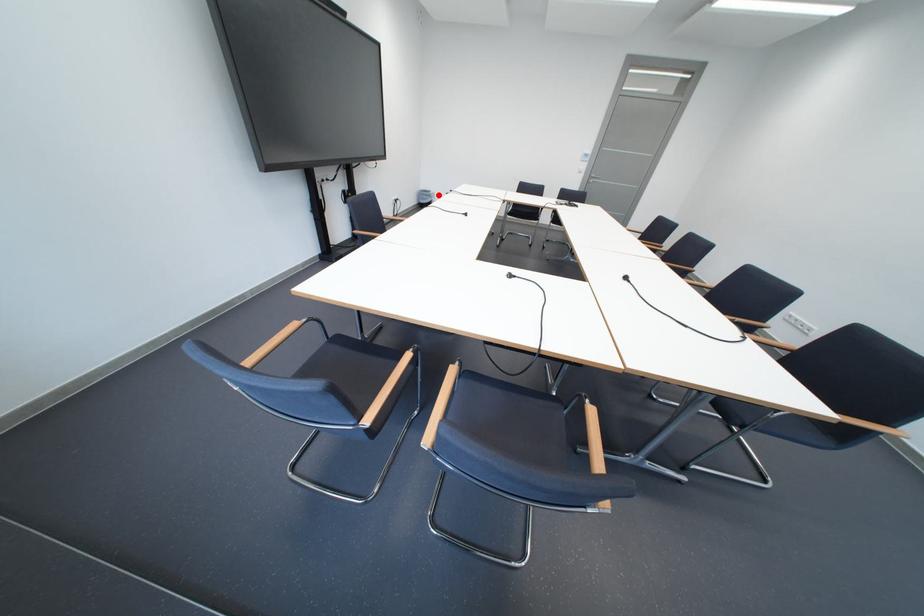
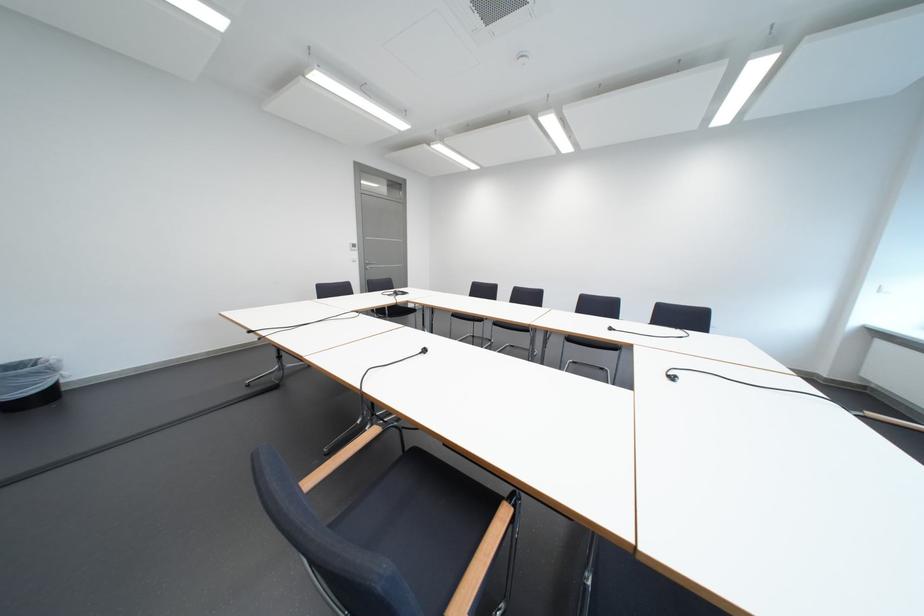
Find the pixel in the second image that matches the highlighted location in the first image.

(23, 373)